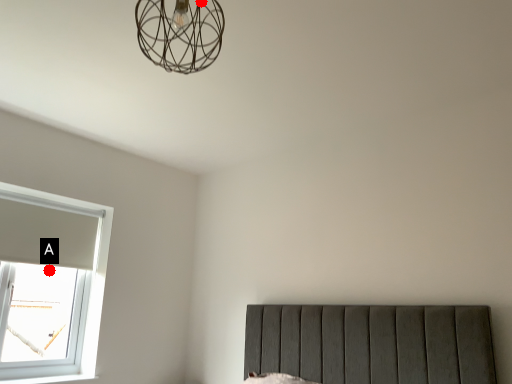
Question: Two points are circled on the image, labeled by A and B beside each circle. Among these points, which one is nearest to the camera?

Choices:
 (A) A is closer
 (B) B is closer

Answer: (B)